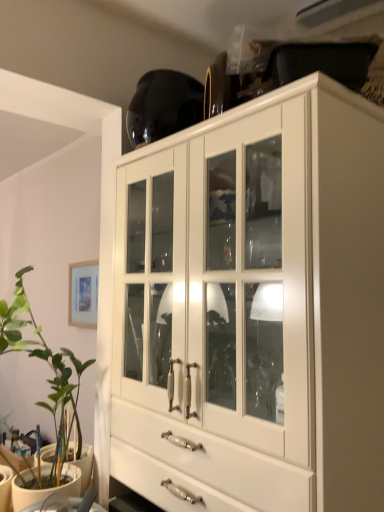
This screenshot has height=512, width=384. What do you see at coordinates (259, 309) in the screenshot? I see `white glossy cabinet at upper center` at bounding box center [259, 309].

The image size is (384, 512). Identify the location of white glossy cabinet at upper center. (259, 309).

Locate an element on the screen. This screenshot has width=384, height=512. green leafy plant at left is located at coordinates (43, 360).

Describe the element at coordinates (43, 360) in the screenshot. This screenshot has height=512, width=384. I see `green leafy plant at left` at that location.

In order to face green leafy plant at left, should I rotate leftwards or rightwards?

You should look left and rotate roughly 23.079 degrees.

Find the location of a particular element. The image size is (384, 512). white glossy cabinet at upper center is located at coordinates [259, 309].

Which is more to the right, white glossy cabinet at upper center or green leafy plant at left?

white glossy cabinet at upper center is more to the right.

Is white glossy cabinet at upper center in front of or behind green leafy plant at left in the image?

Visually, white glossy cabinet at upper center is located in front of green leafy plant at left.

Which is less distant, (306, 121) or (26, 340)?

Point (306, 121) is positioned closer to the camera compared to point (26, 340).

From the image's perspective, relative to green leafy plant at left, is white glossy cabinet at upper center above or below?

white glossy cabinet at upper center is above green leafy plant at left.

From a real-world perspective, relative to green leafy plant at left, is white glossy cabinet at upper center vertically above or below?

From a real-world perspective, white glossy cabinet at upper center is physically above green leafy plant at left.

In terms of width, does white glossy cabinet at upper center look wider or thinner when compared to green leafy plant at left?

Considering their sizes, white glossy cabinet at upper center looks broader than green leafy plant at left.

Is white glossy cabinet at upper center taller or shorter than green leafy plant at left?

white glossy cabinet at upper center is taller than green leafy plant at left.

Looking at the image, does white glossy cabinet at upper center seem bigger or smaller compared to green leafy plant at left?

In the image, white glossy cabinet at upper center appears to be larger than green leafy plant at left.

Is white glossy cabinet at upper center located outside green leafy plant at left?

white glossy cabinet at upper center lies outside green leafy plant at left's area.

Is white glossy cabinet at upper center next to green leafy plant at left and touching it?

No, white glossy cabinet at upper center is not touching green leafy plant at left.

Is green leafy plant at left at the back of white glossy cabinet at upper center?

That's not correct — white glossy cabinet at upper center is not looking away from green leafy plant at left.

How distant is white glossy cabinet at upper center from green leafy plant at left?

20.14 inches.

I want to click on houseplant below the white glossy cabinet at upper center (from the image's perspective), so (x=43, y=360).

Which is more to the right, green leafy plant at left or white glossy cabinet at upper center?

white glossy cabinet at upper center is more to the right.

Is green leafy plant at left positioned behind white glossy cabinet at upper center?

That is True.

Which point is more distant from viewer, [24,296] or [243,139]?

Point [24,296]

From the image's perspective, is green leafy plant at left located above or below white glossy cabinet at upper center?

green leafy plant at left is below white glossy cabinet at upper center.

From a real-world perspective, is green leafy plant at left physically below white glossy cabinet at upper center?

Yes.

Which object is wider, green leafy plant at left or white glossy cabinet at upper center?

Wider between the two is white glossy cabinet at upper center.

Considering the relative sizes of green leafy plant at left and white glossy cabinet at upper center in the image provided, is green leafy plant at left taller than white glossy cabinet at upper center?

In fact, green leafy plant at left may be shorter than white glossy cabinet at upper center.

Considering the sizes of objects green leafy plant at left and white glossy cabinet at upper center in the image provided, who is bigger, green leafy plant at left or white glossy cabinet at upper center?

white glossy cabinet at upper center is bigger.

From the picture: Is white glossy cabinet at upper center a part of green leafy plant at left?

No, white glossy cabinet at upper center is not inside green leafy plant at left.

Is green leafy plant at left far from white glossy cabinet at upper center?

No, green leafy plant at left is not far from white glossy cabinet at upper center.

Does green leafy plant at left turn towards white glossy cabinet at upper center?

No, green leafy plant at left is not aimed at white glossy cabinet at upper center.

How many degrees apart are the facing directions of green leafy plant at left and white glossy cabinet at upper center?

There is a 90-degree angle between the facing directions of green leafy plant at left and white glossy cabinet at upper center.

Image resolution: width=384 pixels, height=512 pixels. In the image, there is a white glossy cabinet at upper center. Find the location of `houseplant below it (from a real-world perspective)`. houseplant below it (from a real-world perspective) is located at coordinates (43, 360).

Identify the location of cabinetry in front of the green leafy plant at left. (259, 309).

Where is `cabinetry lying above the green leafy plant at left (from the image's perspective)`? The height and width of the screenshot is (512, 384). cabinetry lying above the green leafy plant at left (from the image's perspective) is located at coordinates (259, 309).